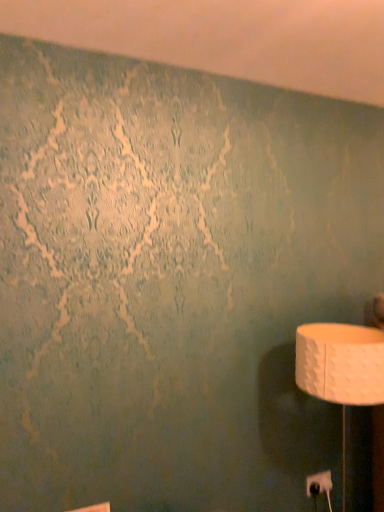
Question: Should I look upward or downward to see white plastic electric outlet at lower right?

Choices:
 (A) up
 (B) down

Answer: (B)